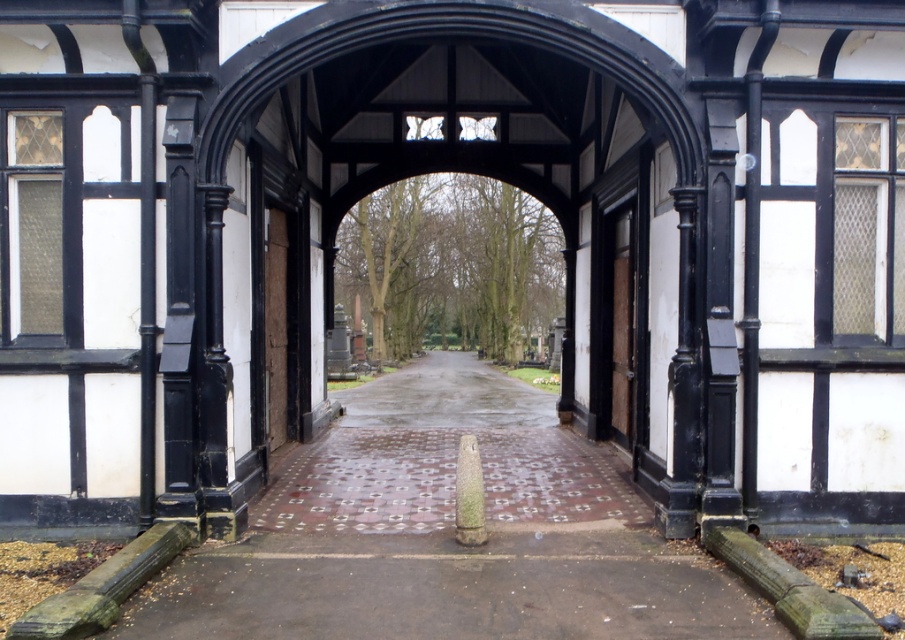
Question: Considering the real-world distances, which object is closest to the black timber archway at center?

Choices:
 (A) brick paved path at center
 (B) wooden door at center

Answer: (B)

Question: Does brick paved path at center appear over wooden door at center?

Choices:
 (A) no
 (B) yes

Answer: (A)

Question: Is black timber archway at center to the right of wooden door at center from the viewer's perspective?

Choices:
 (A) no
 (B) yes

Answer: (A)

Question: Can you confirm if black timber archway at center is positioned below wooden door at center?

Choices:
 (A) no
 (B) yes

Answer: (A)

Question: Considering the real-world distances, which object is closest to the wooden door at center?

Choices:
 (A) brick paved path at center
 (B) black timber archway at center

Answer: (A)

Question: Which object is positioned farthest from the wooden door at center?

Choices:
 (A) brick paved path at center
 (B) black timber archway at center

Answer: (B)